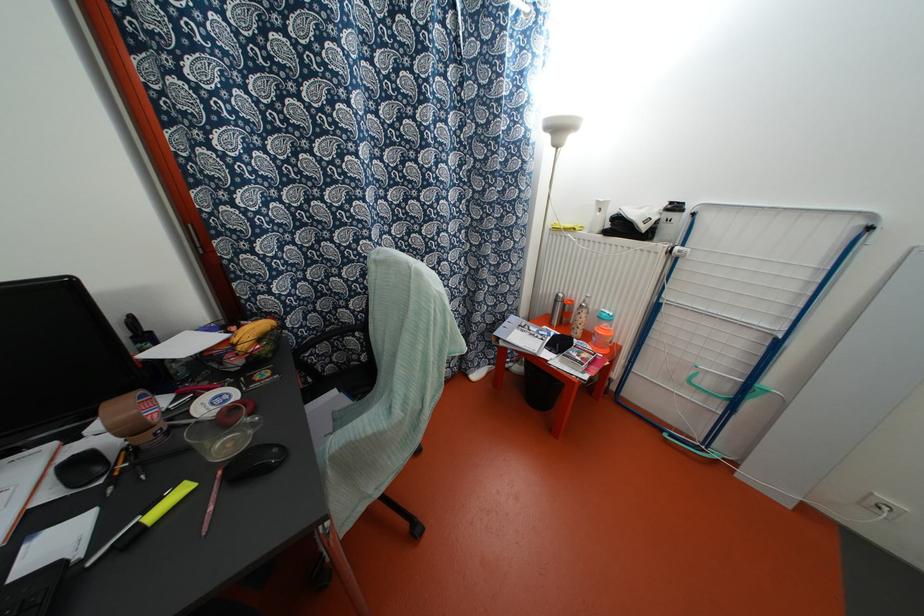
Identify the location of brown packing tape. (134, 418).